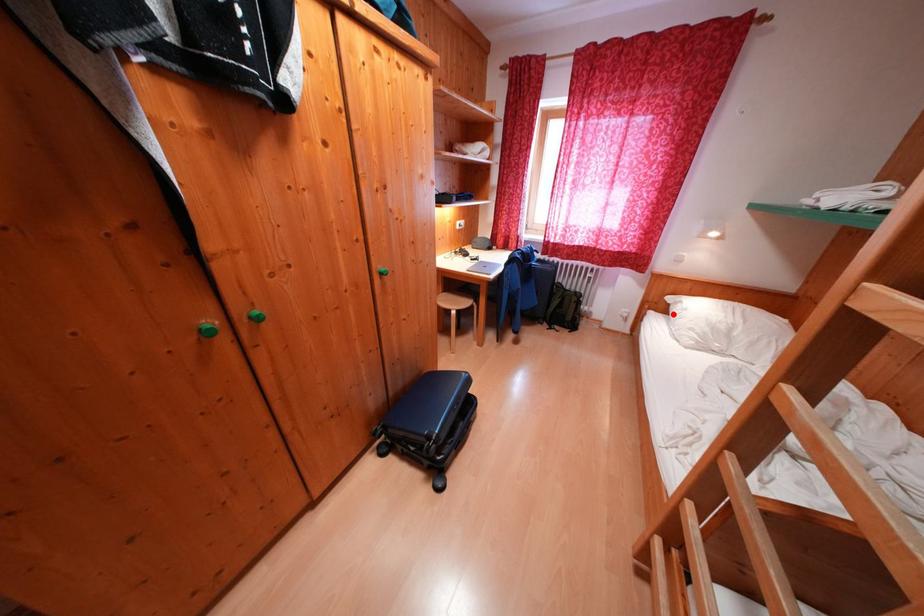
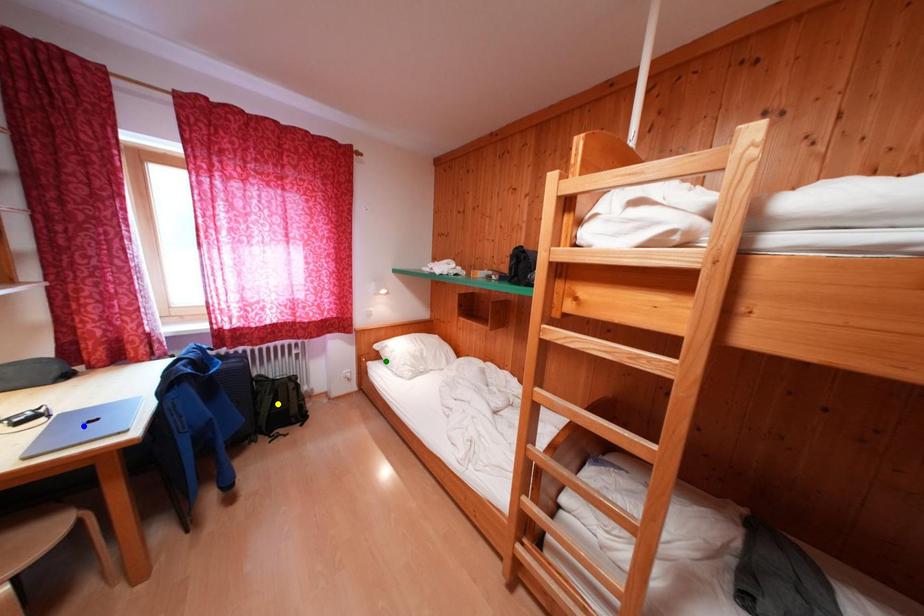
Question: I am providing you with two images of the same scene from different viewpoints. A red point is marked on the first image. You are given multiple points on the second image. Which spot in image 2 lines up with the point in image 1?

Choices:
 (A) blue point
 (B) yellow point
 (C) green point

Answer: (C)